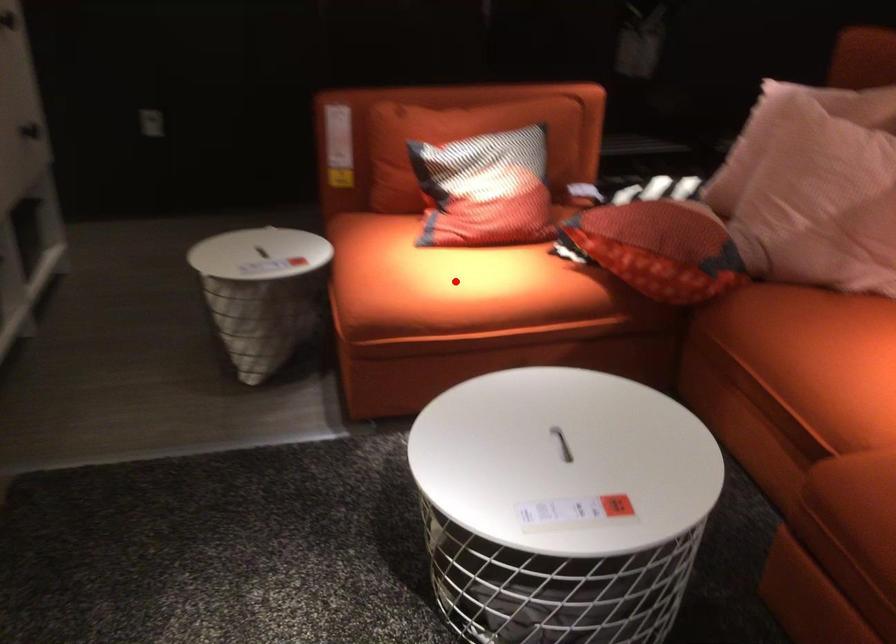
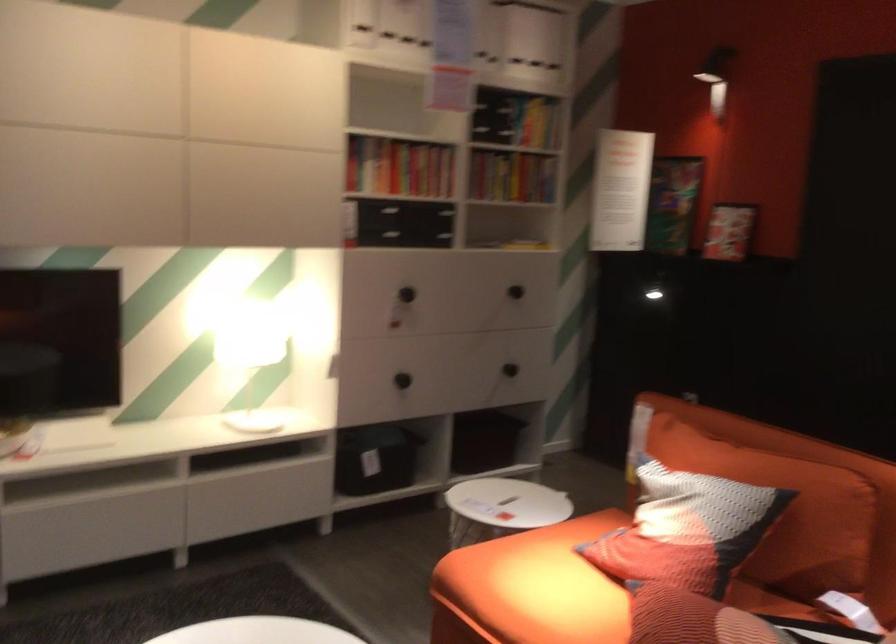
Find the pixel in the second image that matches the highlighted location in the first image.

(531, 588)